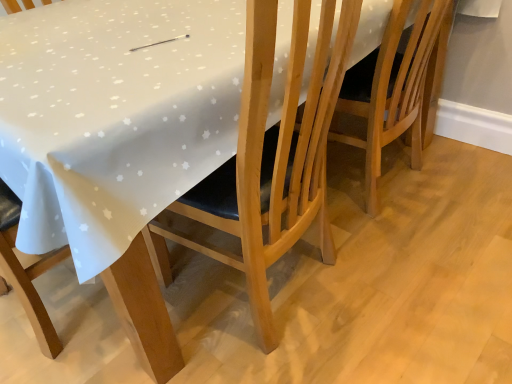
You are a GUI agent. You are given a task and a screenshot of the screen. Output one action in this format:
    pyautogui.click(x=<x>, y=<y>)
    Task: Click on the free space to the right of wooden chair at center, which ranks as the 2th chair in right-to-left order
    Image resolution: width=512 pixels, height=384 pixels.
    Given the screenshot: What is the action you would take?
    pyautogui.click(x=429, y=280)